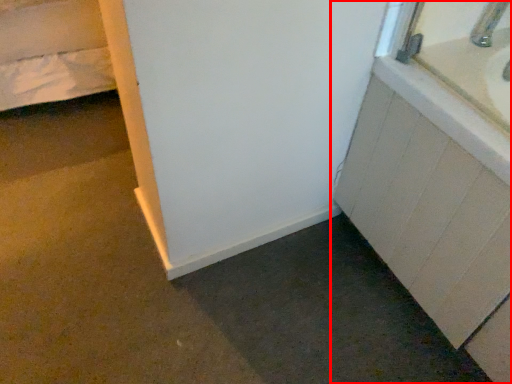
Question: Where is bathroom cabinet (annotated by the red box) located in relation to faucet in the image?

Choices:
 (A) left
 (B) right

Answer: (B)